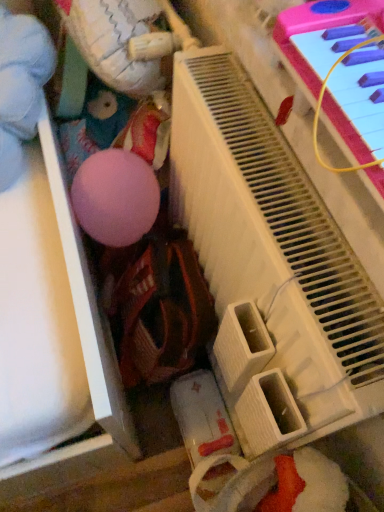
Question: Does pink plastic piano at upper right have a smaller size compared to white matte plush at upper left, the second toy from the left?

Choices:
 (A) no
 (B) yes

Answer: (A)

Question: Can you confirm if pink plastic piano at upper right is shorter than white matte plush at upper left, which ranks as the 1th toy in right-to-left order?

Choices:
 (A) yes
 (B) no

Answer: (B)

Question: Does pink plastic piano at upper right lie in front of white matte plush at upper left, which ranks as the 1th toy in right-to-left order?

Choices:
 (A) yes
 (B) no

Answer: (A)

Question: Would you say pink plastic piano at upper right contains white matte plush at upper left, which ranks as the 1th toy in right-to-left order?

Choices:
 (A) no
 (B) yes

Answer: (A)

Question: From a real-world perspective, does pink plastic piano at upper right stand above white matte plush at upper left, the second toy from the left?

Choices:
 (A) no
 (B) yes

Answer: (A)

Question: Is pink plastic piano at upper right at the left side of white matte plush at upper left, which ranks as the 1th toy in right-to-left order?

Choices:
 (A) no
 (B) yes

Answer: (A)

Question: Is pink plastic piano at upper right not close to matte pink ball at upper left, the second toy when ordered from right to left?

Choices:
 (A) yes
 (B) no

Answer: (B)

Question: Does pink plastic piano at upper right lie behind matte pink ball at upper left, the 1th toy positioned from the left?

Choices:
 (A) yes
 (B) no

Answer: (B)

Question: Can you confirm if pink plastic piano at upper right is taller than matte pink ball at upper left, the 1th toy positioned from the left?

Choices:
 (A) no
 (B) yes

Answer: (B)

Question: Can you confirm if pink plastic piano at upper right is wider than matte pink ball at upper left, the 1th toy positioned from the left?

Choices:
 (A) no
 (B) yes

Answer: (A)

Question: From the image's perspective, is pink plastic piano at upper right on matte pink ball at upper left, the 1th toy positioned from the left?

Choices:
 (A) yes
 (B) no

Answer: (B)

Question: Is pink plastic piano at upper right located outside matte pink ball at upper left, the second toy when ordered from right to left?

Choices:
 (A) yes
 (B) no

Answer: (A)

Question: From the image's perspective, is matte pink ball at upper left, the 1th toy positioned from the left, located beneath white matte plush at upper left, the second toy from the left?

Choices:
 (A) no
 (B) yes

Answer: (B)